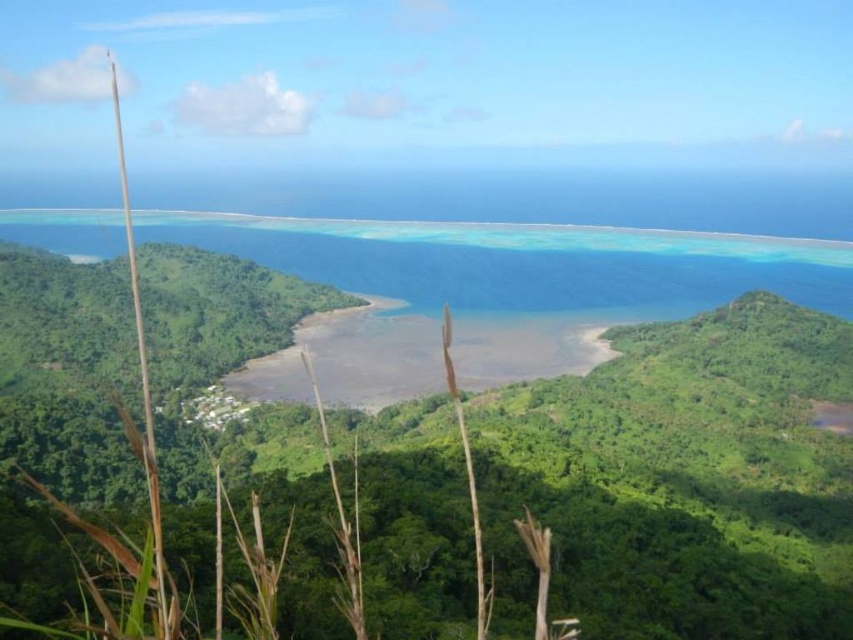
Does green leafy vegetation at center lie in front of clear blue water at center?

Yes, it is in front of clear blue water at center.

Which is in front, point (612, 532) or point (258, 380)?

Point (612, 532) is in front.

The width and height of the screenshot is (853, 640). I want to click on green leafy vegetation at center, so click(x=683, y=477).